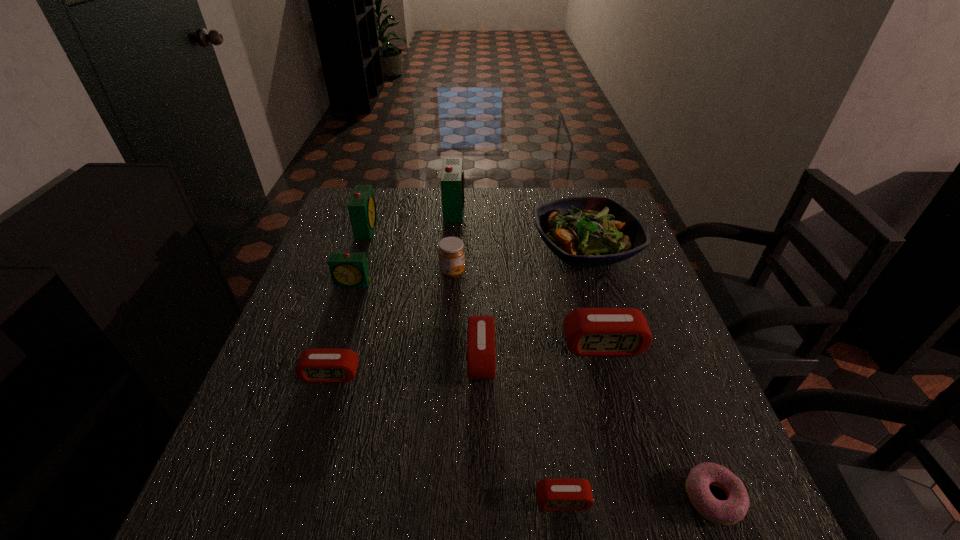
Locate an element on the screen. Image resolution: width=960 pixels, height=540 pixels. the third smallest pink alarm clock is located at coordinates (481, 363).

Identify the location of the second smallest pink alarm clock. coord(315,365).

Locate an element on the screen. The width and height of the screenshot is (960, 540). the sixth tallest alarm clock is located at coordinates (315, 365).

I want to click on the shortest alarm clock, so click(x=552, y=494).

Where is `the second shortest object`? Image resolution: width=960 pixels, height=540 pixels. the second shortest object is located at coordinates (552, 494).

The width and height of the screenshot is (960, 540). Identify the location of the shortest object. (727, 512).

You are a GUI agent. You are given a task and a screenshot of the screen. Output one action in this format:
    pyautogui.click(x=<x>, y=<y>)
    Task: Click on the pink doughnut
    The width and height of the screenshot is (960, 540).
    Given the screenshot: What is the action you would take?
    pyautogui.click(x=727, y=512)

You are a GUI agent. You are given a task and a screenshot of the screen. Output one action in this format:
    pyautogui.click(x=<x>, y=<y>)
    Task: Click on the vacant area located on the front-facing side of the fourth alarm clock from left to right
    Image resolution: width=960 pixels, height=540 pixels.
    Given the screenshot: What is the action you would take?
    pyautogui.click(x=520, y=210)

This screenshot has height=540, width=960. Find the location of `free point located 0.210m on the front-facing side of the second smallest green alarm clock`. free point located 0.210m on the front-facing side of the second smallest green alarm clock is located at coordinates (445, 228).

Where is `blank area located on the left of the blue salad plate`? The height and width of the screenshot is (540, 960). blank area located on the left of the blue salad plate is located at coordinates (488, 249).